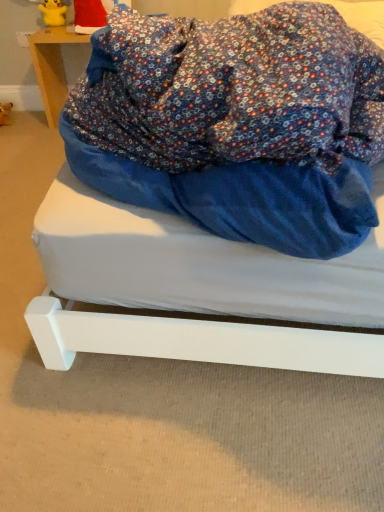
Question: Considering the relative sizes of white matte bed at center and santa hat at upper left in the image provided, is white matte bed at center smaller than santa hat at upper left?

Choices:
 (A) yes
 (B) no

Answer: (B)

Question: Considering the relative positions of white matte bed at center and santa hat at upper left in the image provided, is white matte bed at center in front of santa hat at upper left?

Choices:
 (A) yes
 (B) no

Answer: (A)

Question: Is white matte bed at center looking in the opposite direction of santa hat at upper left?

Choices:
 (A) yes
 (B) no

Answer: (B)

Question: Does white matte bed at center have a lesser height compared to santa hat at upper left?

Choices:
 (A) no
 (B) yes

Answer: (B)

Question: Is santa hat at upper left completely or partially inside white matte bed at center?

Choices:
 (A) yes
 (B) no

Answer: (B)

Question: From the image's perspective, is white matte bed at center located beneath santa hat at upper left?

Choices:
 (A) no
 (B) yes

Answer: (B)

Question: From a real-world perspective, does wooden table at upper left stand above white matte bed at center?

Choices:
 (A) yes
 (B) no

Answer: (A)

Question: Does wooden table at upper left appear on the right side of white matte bed at center?

Choices:
 (A) no
 (B) yes

Answer: (A)

Question: Is wooden table at upper left positioned with its back to white matte bed at center?

Choices:
 (A) no
 (B) yes

Answer: (A)

Question: Is wooden table at upper left not close to white matte bed at center?

Choices:
 (A) no
 (B) yes

Answer: (B)

Question: Is wooden table at upper left positioned beyond the bounds of white matte bed at center?

Choices:
 (A) yes
 (B) no

Answer: (A)

Question: Is wooden table at upper left next to white matte bed at center and touching it?

Choices:
 (A) no
 (B) yes

Answer: (A)

Question: Considering the relative sizes of santa hat at upper left and white matte bed at center in the image provided, is santa hat at upper left bigger than white matte bed at center?

Choices:
 (A) yes
 (B) no

Answer: (B)